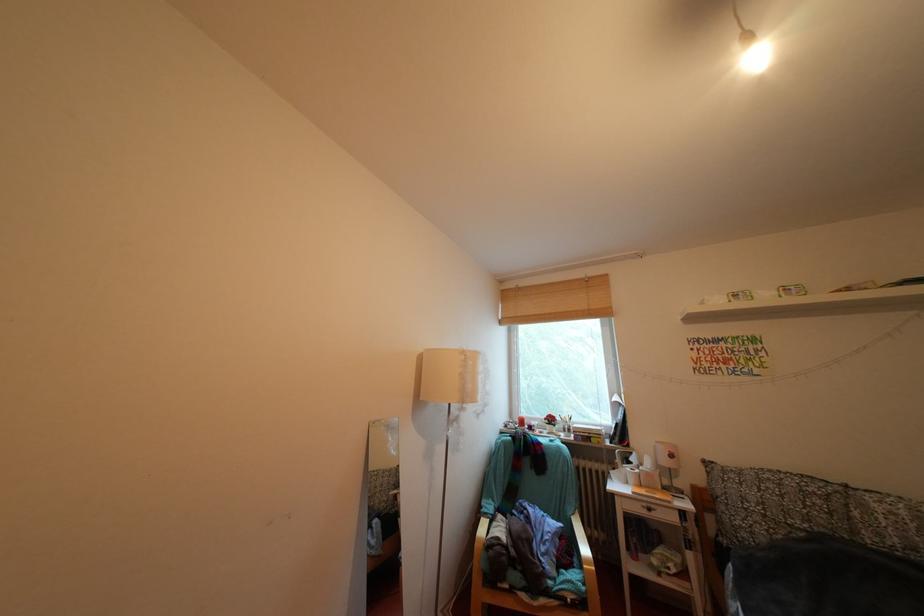
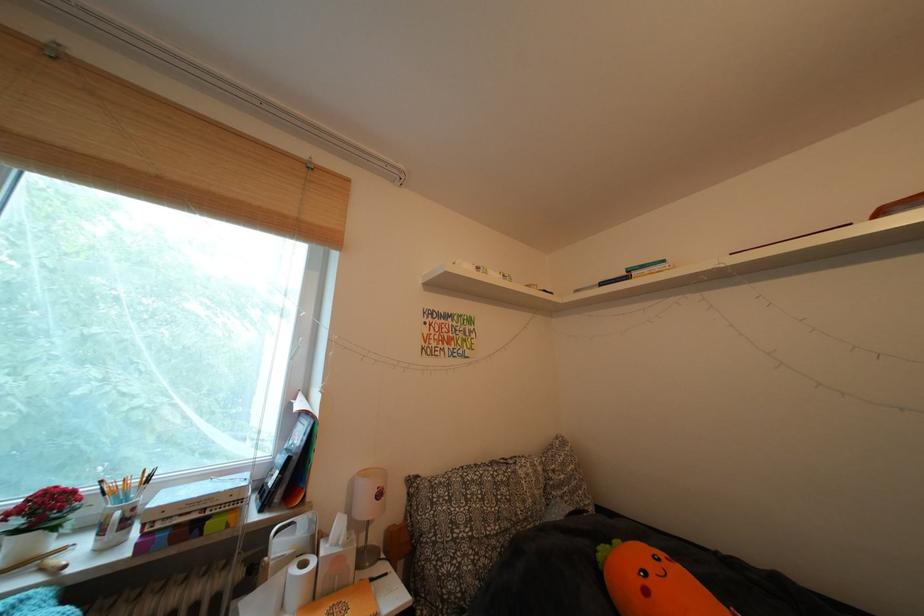
Find the pixel in the second image that matches (x=641, y=485) in the first image.

(306, 602)